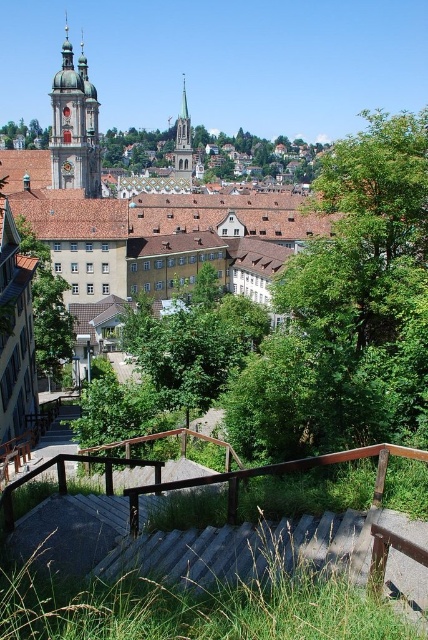
Is brown wooden rail at lower center thinner than green leafy tree at upper center?

Correct, brown wooden rail at lower center's width is less than green leafy tree at upper center's.

Is brown wooden rail at lower center further to the viewer compared to green leafy tree at upper center?

No, it is not.

Who is more forward, (x=166, y=563) or (x=17, y=138)?

Positioned in front is point (x=166, y=563).

Where is `brown wooden rail at lower center`? The width and height of the screenshot is (428, 640). brown wooden rail at lower center is located at coordinates (223, 532).

Is gold-plated spire at upper left positioned before green leafy tree at center?

No.

Who is lower down, gold-plated spire at upper left or green leafy tree at center?

green leafy tree at center is lower down.

Between point (86, 164) and point (23, 218), which one is positioned in front?

Point (23, 218)

Identify the location of gold-plated spire at upper left. Image resolution: width=428 pixels, height=640 pixels. [x=74, y=125].

Which is in front, point (154, 572) or point (80, 152)?

Point (154, 572) is more forward.

Who is more distant from viewer, (228,490) or (71,51)?

Positioned behind is point (71,51).

At what (x,y) coordinates should I click in order to perform the action: click on brown wooden rail at lower center. Please return your answer as a coordinate pair (x, y). Looking at the image, I should click on (223, 532).